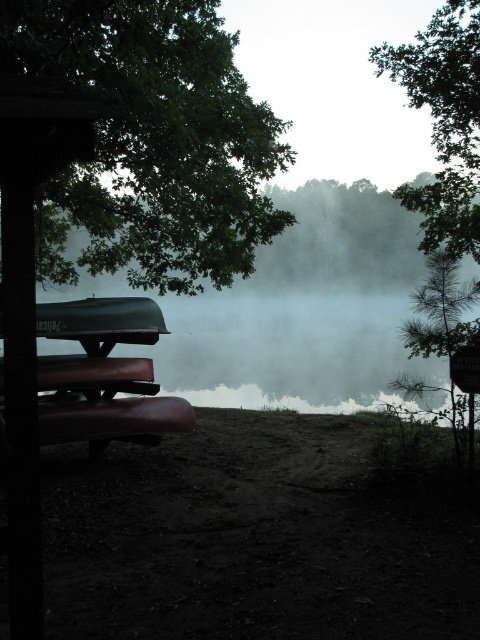
Is green leafy tree at upper left below green leafy tree at upper right?

Actually, green leafy tree at upper left is above green leafy tree at upper right.

Does point (137, 99) lie behind point (398, 77)?

No, (137, 99) is in front of (398, 77).

Identify the location of green leafy tree at upper left. (152, 141).